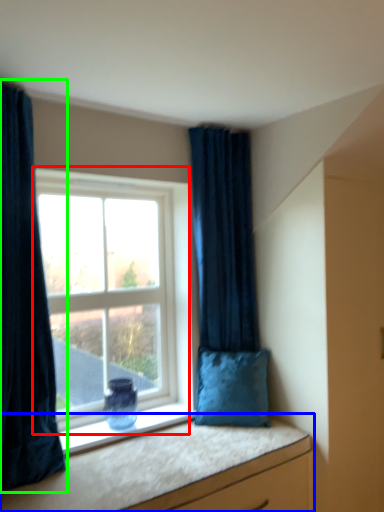
Question: Which object is the farthest from window (highlighted by a red box)? Choose among these: vanity (highlighted by a blue box) or curtain (highlighted by a green box).

Choices:
 (A) vanity
 (B) curtain

Answer: (A)